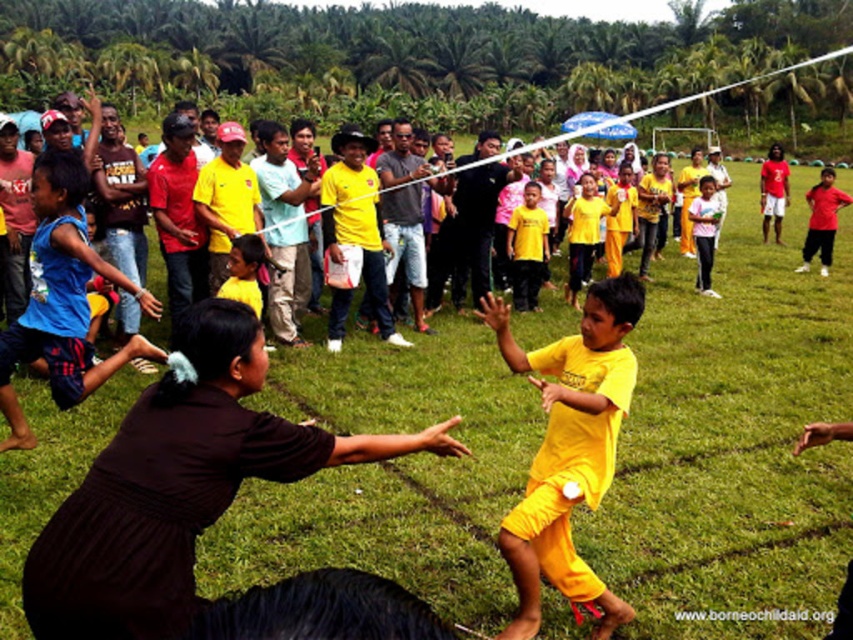
Question: Does brown matte dress at center appear on the left side of yellow matte shorts at center?

Choices:
 (A) yes
 (B) no

Answer: (A)

Question: Which object is farther from the camera taking this photo?

Choices:
 (A) red matte shirt at upper right
 (B) brown matte dress at center
 (C) yellow matte shorts at center

Answer: (A)

Question: Which object is the closest to the red matte shirt at upper right?

Choices:
 (A) blue fabric shorts at left
 (B) brown matte dress at center

Answer: (A)

Question: In this image, where is blue fabric shorts at left located relative to matte black shirt at right?

Choices:
 (A) right
 (B) left

Answer: (B)

Question: Which point is closer to the camera?

Choices:
 (A) blue fabric shorts at left
 (B) brown matte dress at center
 (C) matte black shirt at right
 (D) yellow matte shorts at center

Answer: (B)

Question: Can you confirm if brown matte dress at center is positioned below red matte shirt at upper right?

Choices:
 (A) yes
 (B) no

Answer: (A)